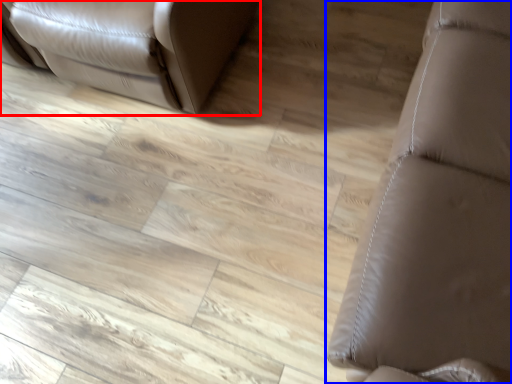
Question: Which point is further to the camera, furniture (highlighted by a red box) or furniture (highlighted by a blue box)?

Choices:
 (A) furniture
 (B) furniture

Answer: (A)